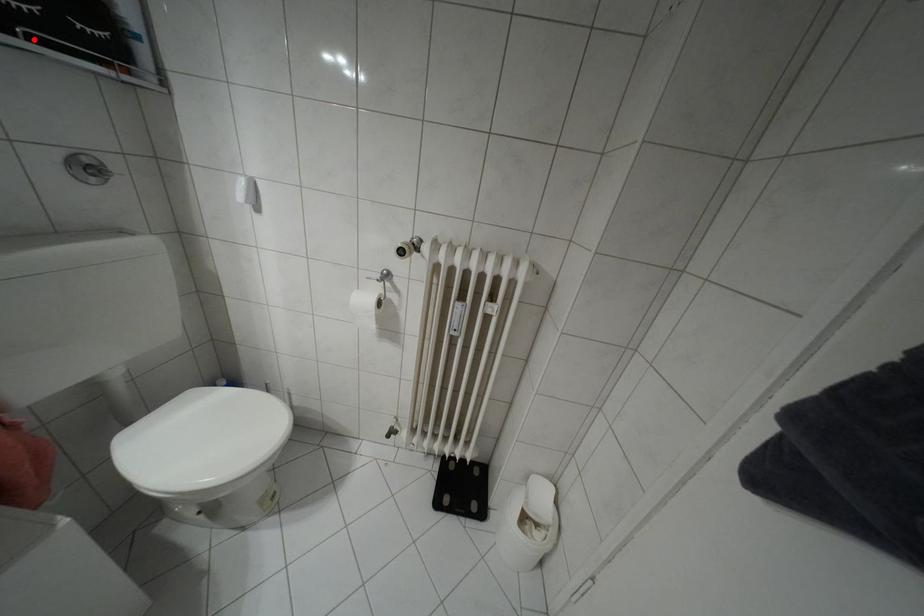
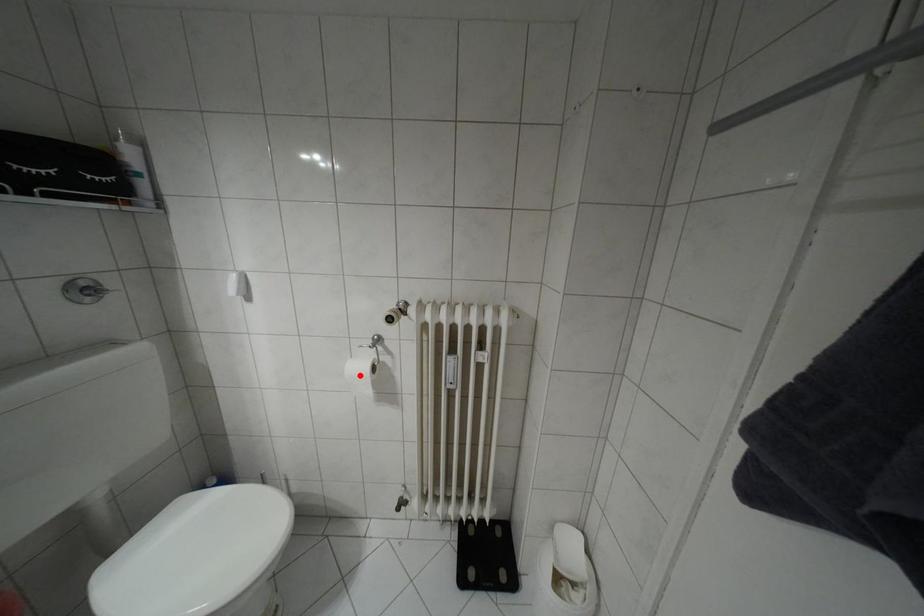
I am providing you with two images of the same scene from different viewpoints. A red point is marked on the first image and another point is marked on the second image. Does the point marked in image1 correspond to the same location as the one in image2?

No